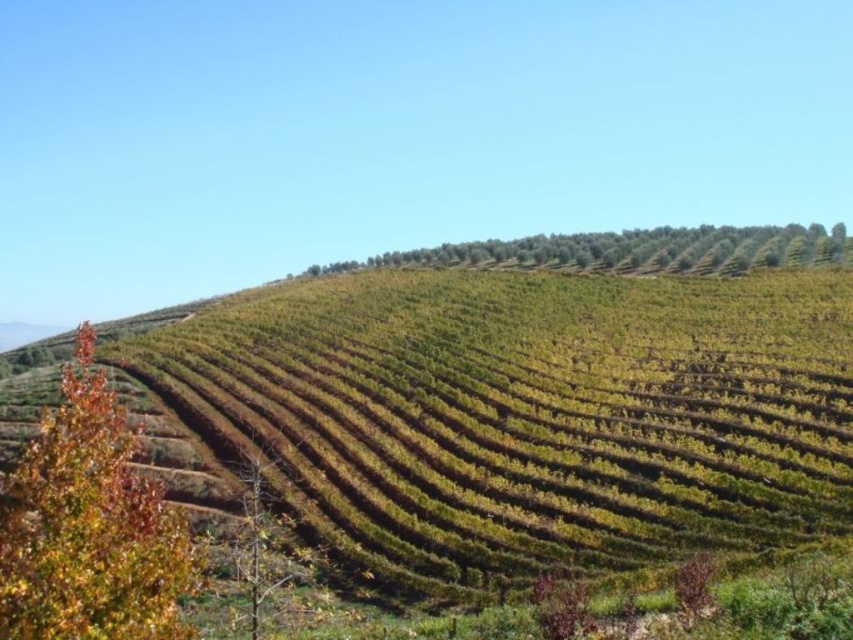
Between multicolored foliage at left and brown leafless tree at lower left, which one has more height?

Standing taller between the two is multicolored foliage at left.

Is point (0, 608) closer to viewer compared to point (271, 612)?

Yes, it is.

At what (x,y) coordinates should I click in order to perform the action: click on multicolored foliage at left. Please return your answer as a coordinate pair (x, y). Image resolution: width=853 pixels, height=640 pixels. Looking at the image, I should click on (90, 525).

Can you confirm if multicolored foliage at left is positioned to the left of green leafy trees at upper center?

Correct, you'll find multicolored foliage at left to the left of green leafy trees at upper center.

Locate an element on the screen. multicolored foliage at left is located at coordinates (90, 525).

Does green leafy trees at upper center have a lesser width compared to brown leafless tree at lower left?

In fact, green leafy trees at upper center might be wider than brown leafless tree at lower left.

In the scene shown: Can you confirm if green leafy trees at upper center is positioned to the right of brown leafless tree at lower left?

Correct, you'll find green leafy trees at upper center to the right of brown leafless tree at lower left.

Is point (650, 268) more distant than point (241, 538)?

Yes, point (650, 268) is farther from viewer.

Locate an element on the screen. green leafy trees at upper center is located at coordinates (636, 252).